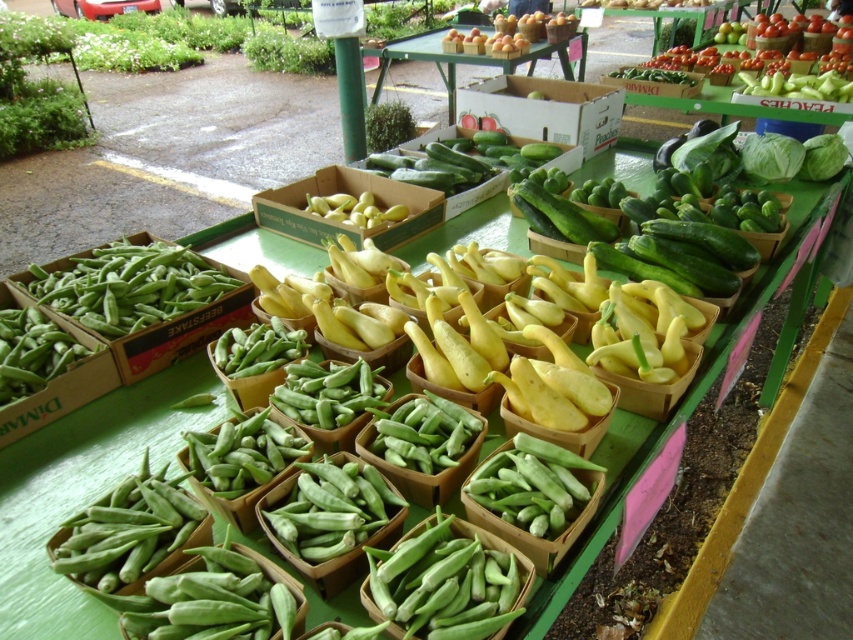
You are a customer at the market stall. You want to place a small basket of strawberries between the green matte okra at center and the white cardboard box at center. Based on their widths, will the basket fit between them?

The green matte okra at center has a lesser width compared to white cardboard box at center, so there should be enough space between them to place the small basket of strawberries.

You are at the market stall and want to pick up an item located at point (x=369, y=609) and another item at point (x=527, y=67). Which item will be easier to reach without moving your position?

The item at point (x=369, y=609) will be easier to reach because it is closer to you than the item at point (x=527, y=67).